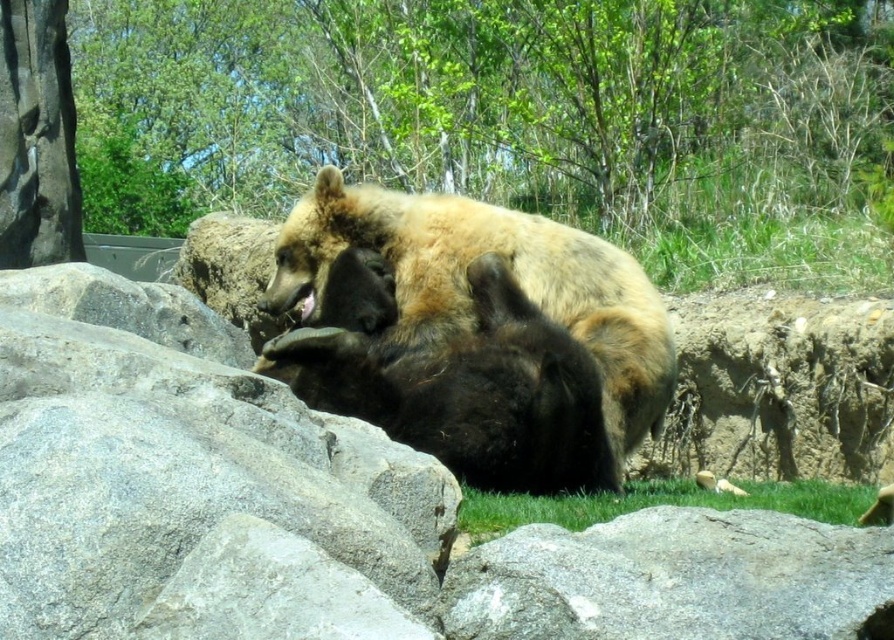
In order to click on green leafy tree at upper center in this screenshot , I will do `click(482, 102)`.

Who is higher up, green leafy tree at upper center or green grass at lower center?

Positioned higher is green leafy tree at upper center.

Does point (814, 196) come closer to viewer compared to point (821, 506)?

No, it is not.

The image size is (894, 640). What are the coordinates of `green leafy tree at upper center` in the screenshot? It's located at (482, 102).

Is gray rough rock at lower center to the right of green grass at lower center from the viewer's perspective?

No, gray rough rock at lower center is not to the right of green grass at lower center.

Is gray rough rock at lower center positioned at the back of green grass at lower center?

No, gray rough rock at lower center is closer to the viewer.

Is point (863, 604) positioned after point (637, 484)?

No, (863, 604) is in front of (637, 484).

The image size is (894, 640). Find the location of `gray rough rock at lower center`. gray rough rock at lower center is located at coordinates (675, 579).

How far apart are green leafy tree at upper center and gray rough rock at lower center?

green leafy tree at upper center is 10.31 meters from gray rough rock at lower center.

Does green leafy tree at upper center have a lesser width compared to gray rough rock at lower center?

In fact, green leafy tree at upper center might be wider than gray rough rock at lower center.

Where is `green leafy tree at upper center`? green leafy tree at upper center is located at coordinates pyautogui.click(x=482, y=102).